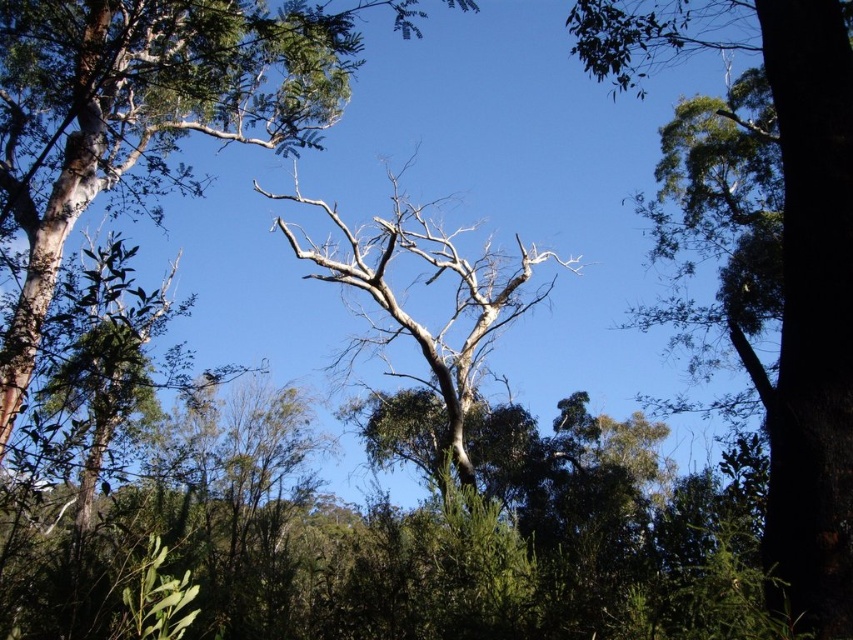
Question: Does smooth bark tree at center appear on the left side of green leafy tree at upper right?

Choices:
 (A) no
 (B) yes

Answer: (B)

Question: Which point is closer to the camera?

Choices:
 (A) smooth bark tree at center
 (B) green leafy tree at upper right
 (C) bare wood tree at center

Answer: (B)

Question: Which of these objects is positioned farthest from the green leafy tree at upper right?

Choices:
 (A) smooth bark tree at center
 (B) bare wood tree at center

Answer: (B)

Question: In this image, where is smooth bark tree at center located relative to bare wood tree at center?

Choices:
 (A) right
 (B) left

Answer: (B)

Question: Can you confirm if green leafy tree at upper right is positioned above bare wood tree at center?

Choices:
 (A) yes
 (B) no

Answer: (B)

Question: Which point is closer to the camera?

Choices:
 (A) (347, 230)
 (B) (32, 10)

Answer: (B)